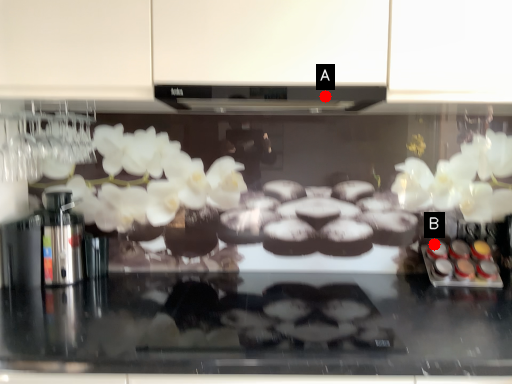
Question: Two points are circled on the image, labeled by A and B beside each circle. Which point appears farthest from the camera in this image?

Choices:
 (A) A is further
 (B) B is further

Answer: (B)